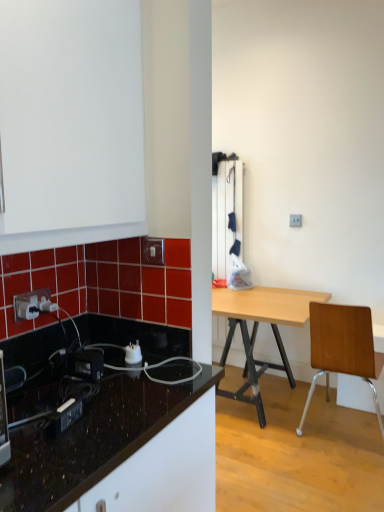
Question: In terms of width, does white glossy power outlet at upper left look wider or thinner when compared to white plastic power plugs and sockets at lower left?

Choices:
 (A) thin
 (B) wide

Answer: (A)

Question: Does point (21, 310) appear closer or farther from the camera than point (127, 353)?

Choices:
 (A) farther
 (B) closer

Answer: (B)

Question: Considering the real-world distances, which object is farthest from the brown wooden chair at right?

Choices:
 (A) white glossy power outlet at upper left
 (B) white plastic power plugs and sockets at lower left
 (C) white glossy electric outlet at upper center
 (D) black glossy countertop at lower left

Answer: (A)

Question: Which of these objects is positioned closest to the white glossy electric outlet at upper center?

Choices:
 (A) brown wooden chair at right
 (B) white glossy power outlet at upper left
 (C) white plastic power plugs and sockets at lower left
 (D) black glossy countertop at lower left

Answer: (C)